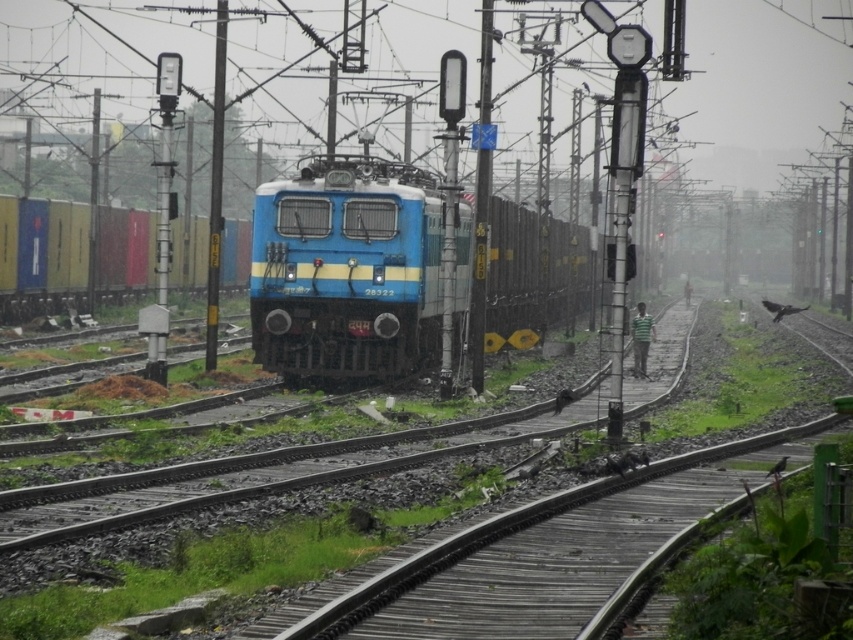
Question: Which point is closer to the camera?

Choices:
 (A) blue matte train at center
 (B) wooden at center

Answer: (B)

Question: Is blue matte train at center smaller than wooden at center?

Choices:
 (A) yes
 (B) no

Answer: (B)

Question: Among these objects, which one is farthest from the camera?

Choices:
 (A) wooden at center
 (B) blue matte train at center
 (C) blue glossy locomotive at center

Answer: (C)

Question: Is blue glossy locomotive at center to the left of blue matte train at center from the viewer's perspective?

Choices:
 (A) no
 (B) yes

Answer: (A)

Question: Which of these objects is positioned farthest from the blue glossy locomotive at center?

Choices:
 (A) wooden at center
 (B) blue matte train at center

Answer: (A)

Question: Is blue glossy locomotive at center smaller than wooden at center?

Choices:
 (A) yes
 (B) no

Answer: (B)